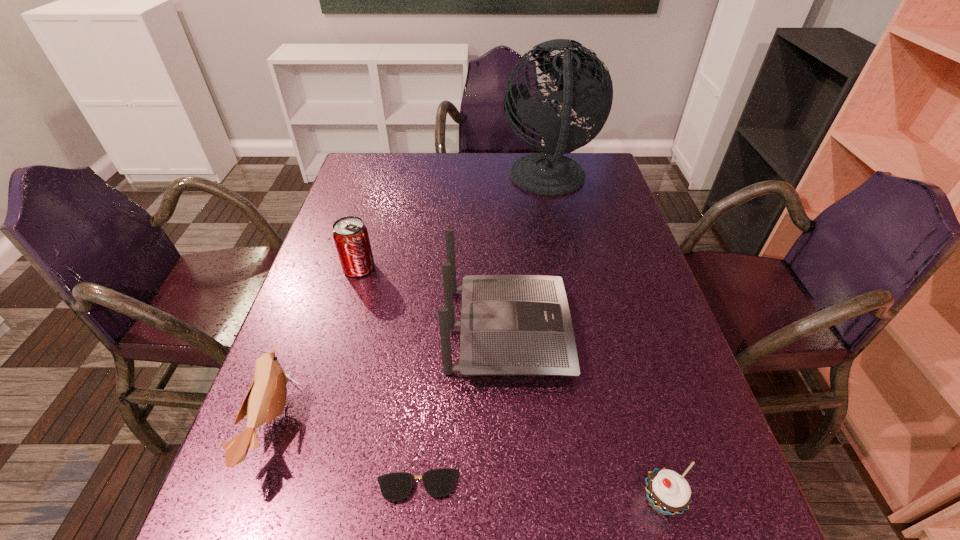
Identify the location of blank space located on the front-facing side of the globe. pos(409,180).

Where is `vacant space located on the front-facing side of the router`? This screenshot has height=540, width=960. vacant space located on the front-facing side of the router is located at coordinates (644, 330).

Identify the location of vacant space situated on the back of the fifth nearest object. This screenshot has width=960, height=540. (377, 204).

The height and width of the screenshot is (540, 960). I want to click on vacant space located at the beak of the leftmost object, so click(355, 424).

Find the location of `free space located on the left of the fifth tallest object`. free space located on the left of the fifth tallest object is located at coordinates (470, 501).

At what (x,y) coordinates should I click in order to perform the action: click on vacant space located 0.060m on the back of the spectacles. Please return your answer as a coordinate pair (x, y). The height and width of the screenshot is (540, 960). Looking at the image, I should click on (422, 437).

At what (x,y) coordinates should I click in order to perform the action: click on object that is at the far edge. Please return your answer as a coordinate pair (x, y). Looking at the image, I should click on (587, 85).

Identify the location of pop soda located in the left edge section of the desktop. tap(350, 235).

What are the coordinates of `bird located at the left edge` in the screenshot? It's located at (266, 398).

Locate an element on the screen. The height and width of the screenshot is (540, 960). globe present at the right edge is located at coordinates (587, 85).